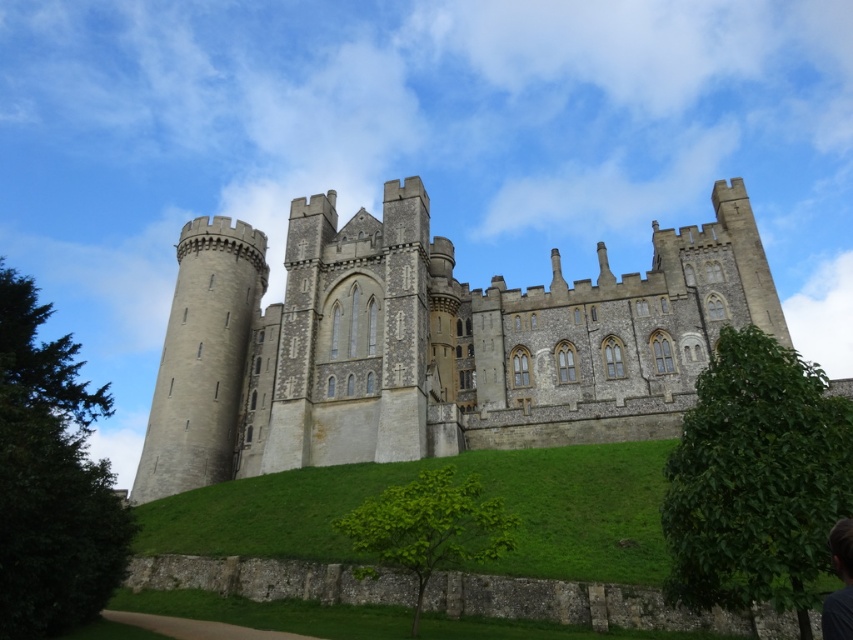
You are standing at the base of the castle hill and want to reach the point marked at coordinates point (770,275). If your maximum walking distance is 250 feet, can you reach it without exceeding your limit?

The distance of point (770,275) from viewer is 242.02 feet, so yes, you can reach it since it is within your 250 feet limit.

You are standing at the base of the castle hill and see the gray stone castle at center. If you walk straight towards the point marked by point (x=418, y=337), will you be heading directly toward the gray stone castle at center?

Yes, because point (x=418, y=337) marks the location of the gray stone castle at center.

You are a visitor standing at the base of the gray stone castle at center and looking towards the dark brown hair at lower right. Which object appears taller from your perspective?

The gray stone castle at center appears taller than the dark brown hair at lower right because it is much taller as stated in the description.